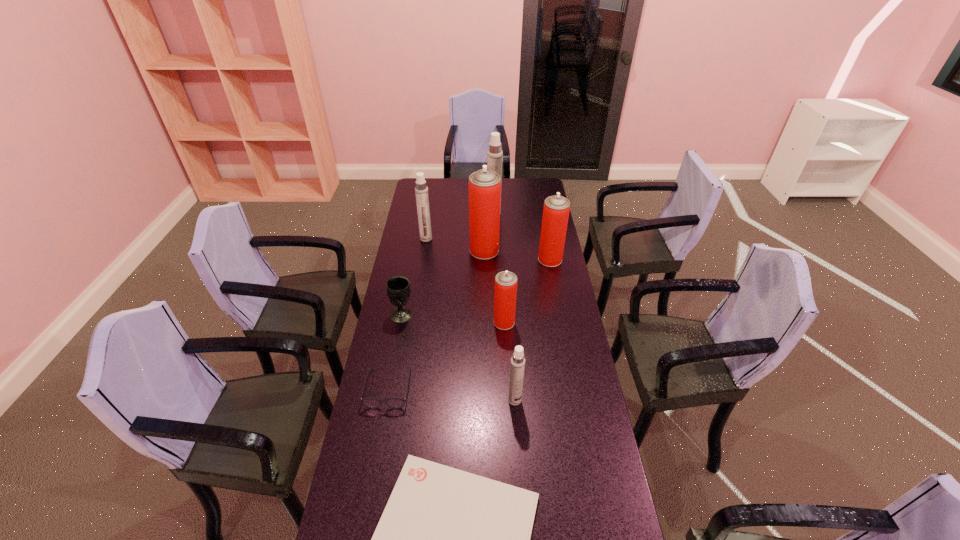
What are the coordinates of `the biggest white aerosol can` in the screenshot? It's located at (494, 155).

This screenshot has height=540, width=960. Find the location of `the farthest object`. the farthest object is located at coordinates (494, 155).

Where is `the biggest red aerosol can`? the biggest red aerosol can is located at coordinates (484, 185).

Identify the location of the second smallest white aerosol can. The image size is (960, 540). (421, 190).

Image resolution: width=960 pixels, height=540 pixels. What are the coordinates of `the second farthest white aerosol can` in the screenshot? It's located at (421, 190).

At what (x,y) coordinates should I click in order to perform the action: click on the rightmost aerosol can. Please return your answer as a coordinate pair (x, y). Looking at the image, I should click on (556, 209).

Where is `the rightmost red aerosol can`? the rightmost red aerosol can is located at coordinates click(x=556, y=209).

I want to click on the fifth farthest aerosol can, so click(505, 293).

Find the location of a particular element. Image resolution: width=960 pixels, height=540 pixels. the nearest red aerosol can is located at coordinates (505, 293).

Where is `the nearest aerosol can`? This screenshot has width=960, height=540. the nearest aerosol can is located at coordinates (517, 367).